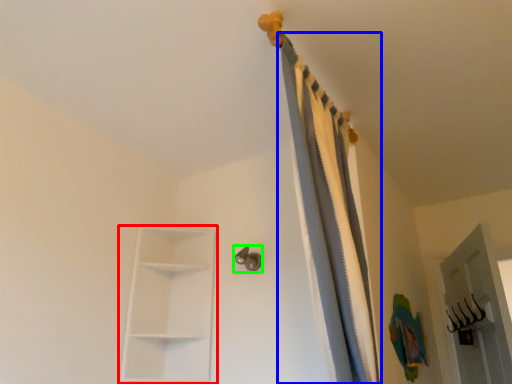
Question: Which object is positioned closest to shelf (highlighted by a red box)? Select from curtain (highlighted by a blue box) and door handle (highlighted by a green box).

Choices:
 (A) curtain
 (B) door handle

Answer: (B)